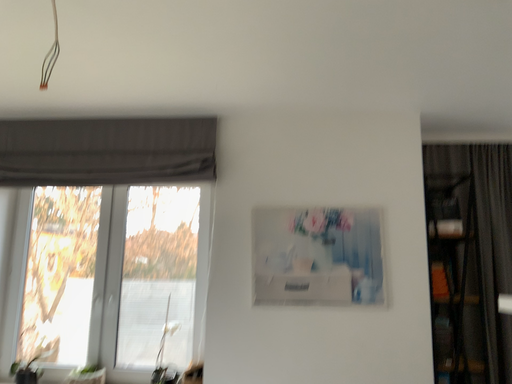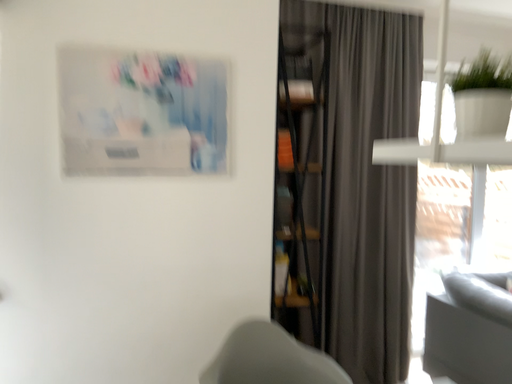
Question: Which way did the camera rotate in the video?

Choices:
 (A) rotated upward
 (B) rotated downward

Answer: (B)